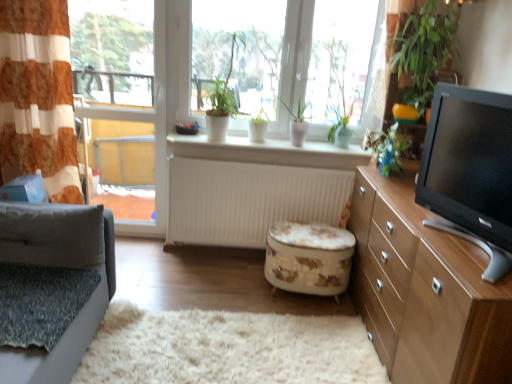
Identify the location of blank space situated above white matte window sill at center (from a real-world perspective). Image resolution: width=512 pixels, height=384 pixels. (275, 139).